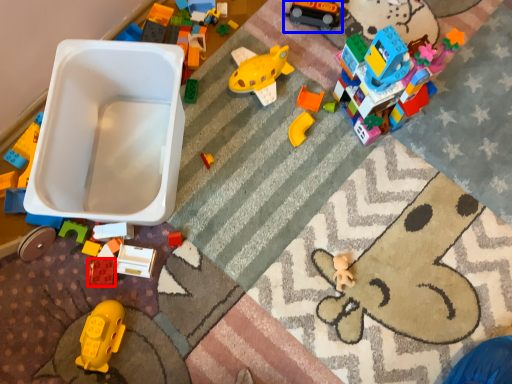
Question: Which object appears farthest to the camera in this image, toy (highlighted by a red box) or toy (highlighted by a blue box)?

Choices:
 (A) toy
 (B) toy

Answer: (B)